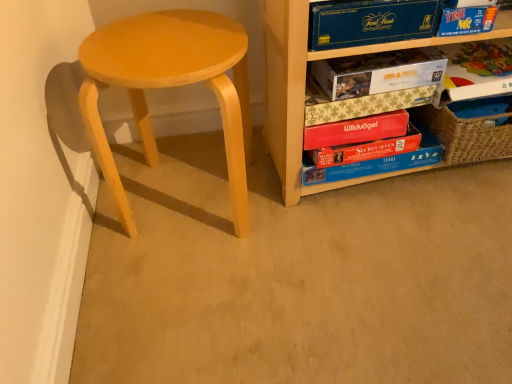
Where is `free space in front of blue cardboard puzzle box at center, marked as the 7th paperback book in a top-to-bottom arrangement`? Image resolution: width=512 pixels, height=384 pixels. free space in front of blue cardboard puzzle box at center, marked as the 7th paperback book in a top-to-bottom arrangement is located at coordinates (407, 228).